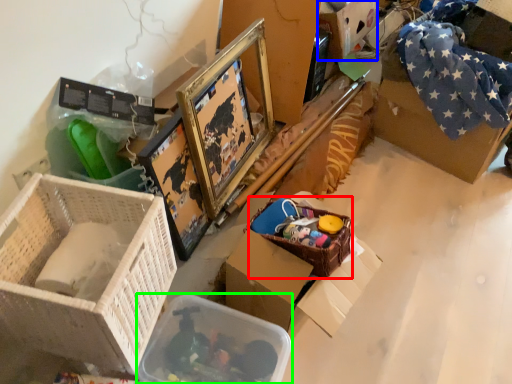
Question: Based on their relative distances, which object is farther from basket (highlighted by a red box)? Choose from storage box (highlighted by a blue box) and storage box (highlighted by a green box).

Choices:
 (A) storage box
 (B) storage box

Answer: (A)